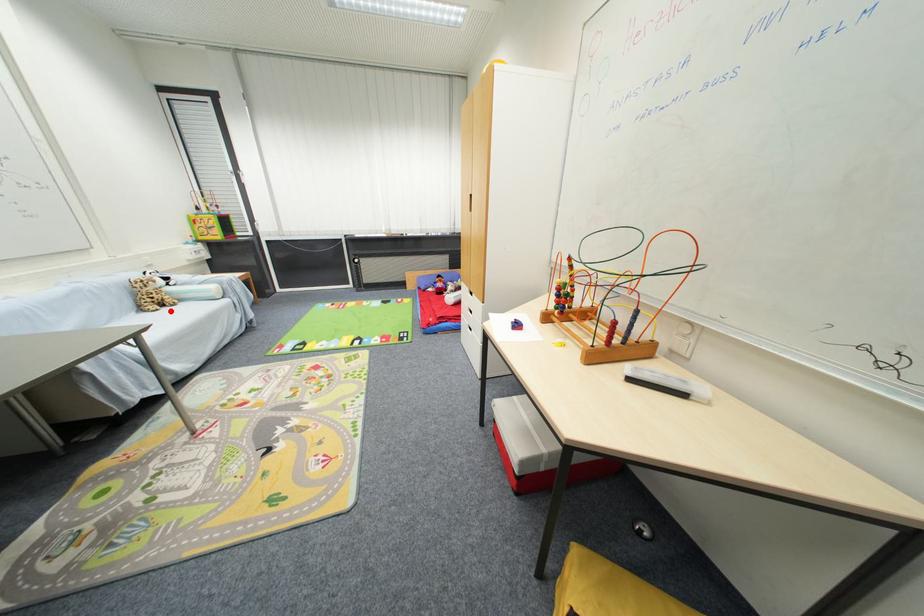
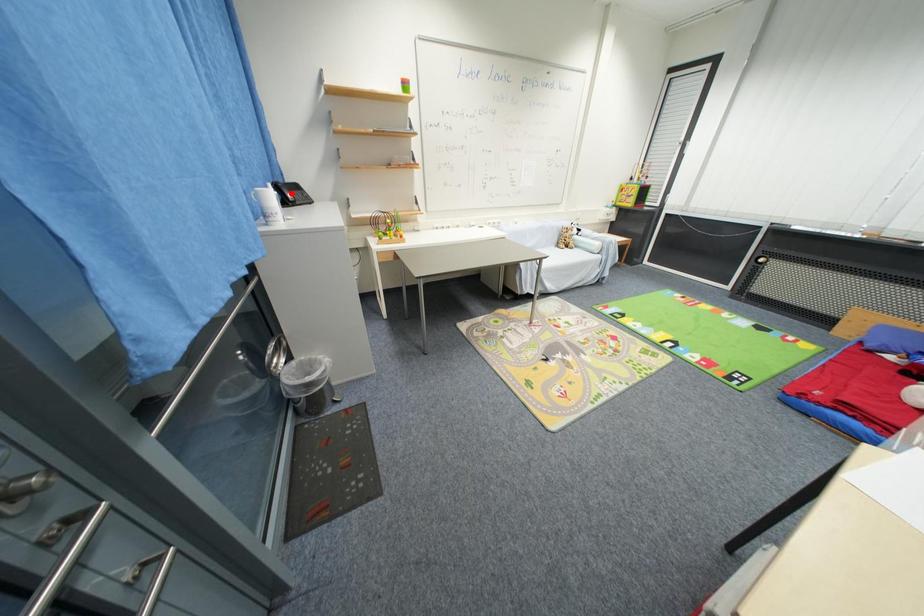
I am providing you with two images of the same scene from different viewpoints. A red point is marked on the first image and another point is marked on the second image. Does the point marked in image1 correspond to the same location as the one in image2?

No